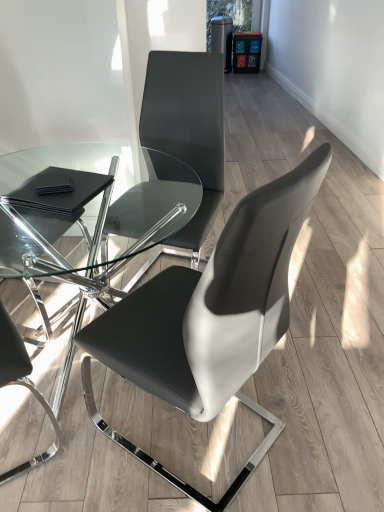
I want to click on vacant space to the right of transparent glass table at center, so click(x=322, y=364).